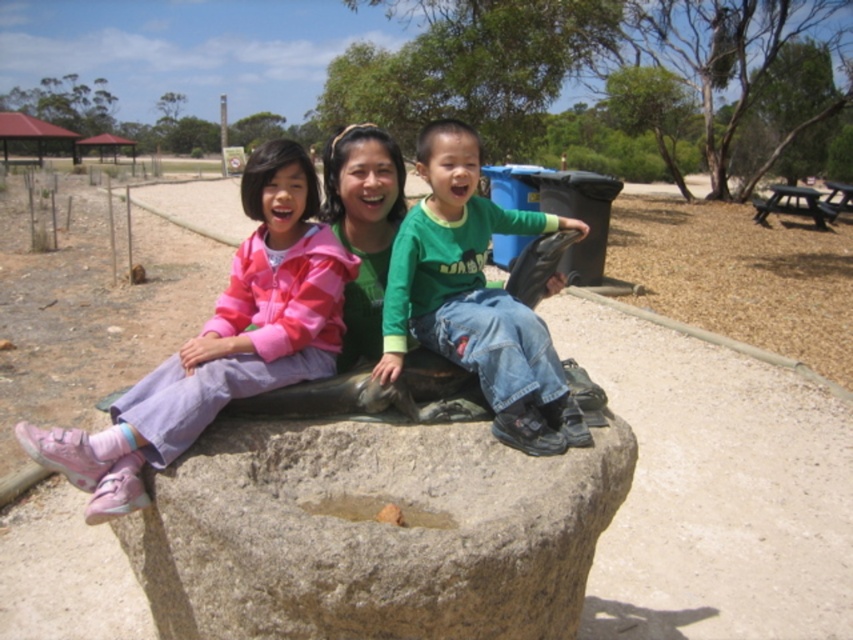
You are a photographer setting up a tripod to take a group photo of the pink fleece jacket at left and the green cotton shirt at center. If the tripod can only accommodate two people side by side without overlapping, will both fit comfortably?

The pink fleece jacket at left might be wider than green cotton shirt at center, so there is a possibility that they won t fit comfortably side by side without overlapping. The photographer should consider adjusting the tripod s width or have them move closer together.

You are a photographer trying to capture a group photo of the pink fleece jacket at left and the green cotton shirt at center. If your camera can only focus on objects within a 20 inch range, will both subjects be in focus?

The pink fleece jacket at left is 18.64 inches from the green cotton shirt at center. Since the distance between them is within the 20 inch range, both subjects will be in focus.

You are a photographer standing at the center of the image. You want to place your camera so that the smooth stone boulder at center is exactly in the middle of your shot. Where should you position the camera relative to the boulder?

Since the smooth stone boulder at center is already located at the 2D coordinates of point (372, 532), positioning the camera directly facing the boulder and aligning it to the center of the shot would require adjusting the camera to match those coordinates. However, since the boulder is already at the center of the image, the photographer should ensure the camera is centered on it.